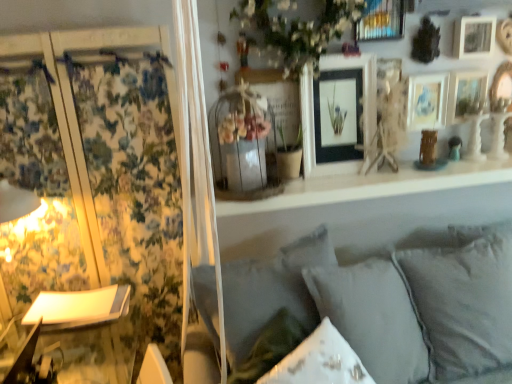
This screenshot has width=512, height=384. Identify the location of free space above floral fabric curtain at left (from a real-world perspective). (67, 33).